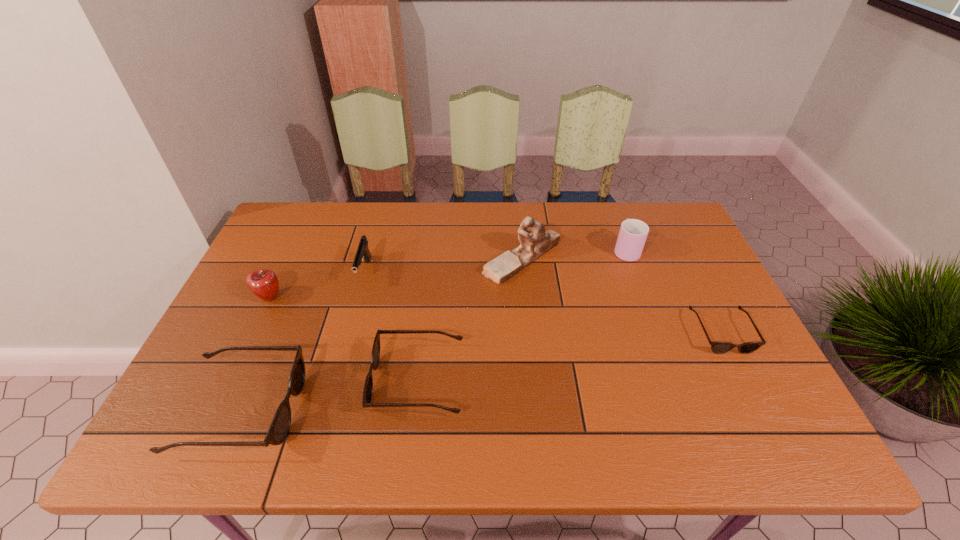
Locate an element on the screen. Image resolution: width=960 pixels, height=540 pixels. the leftmost sunglasses is located at coordinates (280, 425).

The width and height of the screenshot is (960, 540). In order to click on the second sunglasses from right to left in this screenshot , I will do `click(375, 355)`.

At what (x,y) coordinates should I click in order to perform the action: click on the second tallest sunglasses. Please return your answer as a coordinate pair (x, y). Looking at the image, I should click on (375, 355).

Identify the location of the rightmost sunglasses. coord(717,347).

Image resolution: width=960 pixels, height=540 pixels. Find the location of `the shortest object`. the shortest object is located at coordinates (717, 347).

I want to click on figurine, so click(x=535, y=241).

You are a GUI agent. You are given a task and a screenshot of the screen. Output one action in this format:
    pyautogui.click(x=<x>, y=<y>)
    Task: Click on the tallest object
    
    Given the screenshot: What is the action you would take?
    pyautogui.click(x=535, y=241)

Locate an element on the screen. cup is located at coordinates (633, 233).

You are a GUI agent. You are given a task and a screenshot of the screen. Output one action in this format:
    pyautogui.click(x=<x>, y=<y>)
    Task: Click on the apple
    This screenshot has height=540, width=960.
    Given the screenshot: What is the action you would take?
    pyautogui.click(x=263, y=283)

Locate an element on the screen. This screenshot has height=540, width=960. the third object from left to right is located at coordinates (363, 252).